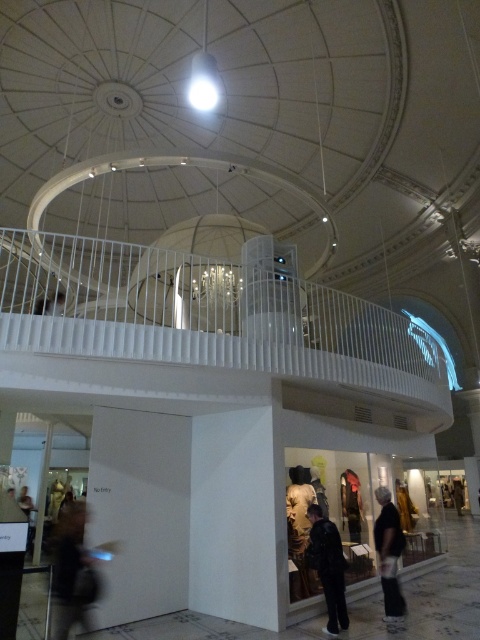
Question: Does black leather jacket at lower center have a greater width compared to dark gray fabric jacket at lower center?

Choices:
 (A) no
 (B) yes

Answer: (B)

Question: Can you confirm if dark gray backpack at lower left is positioned to the left of dark gray fabric jacket at lower center?

Choices:
 (A) yes
 (B) no

Answer: (A)

Question: Which is farther from the dark gray backpack at lower left?

Choices:
 (A) dark gray fabric jacket at lower center
 (B) black leather jacket at lower center

Answer: (A)

Question: Which is farther from the dark gray backpack at lower left?

Choices:
 (A) black leather jacket at lower center
 (B) dark gray fabric jacket at lower center

Answer: (B)

Question: Is black leather jacket at lower center thinner than dark gray fabric jacket at lower center?

Choices:
 (A) yes
 (B) no

Answer: (B)

Question: Which point is closer to the camera?

Choices:
 (A) dark gray backpack at lower left
 (B) black leather jacket at lower center
 (C) dark gray fabric jacket at lower center

Answer: (A)